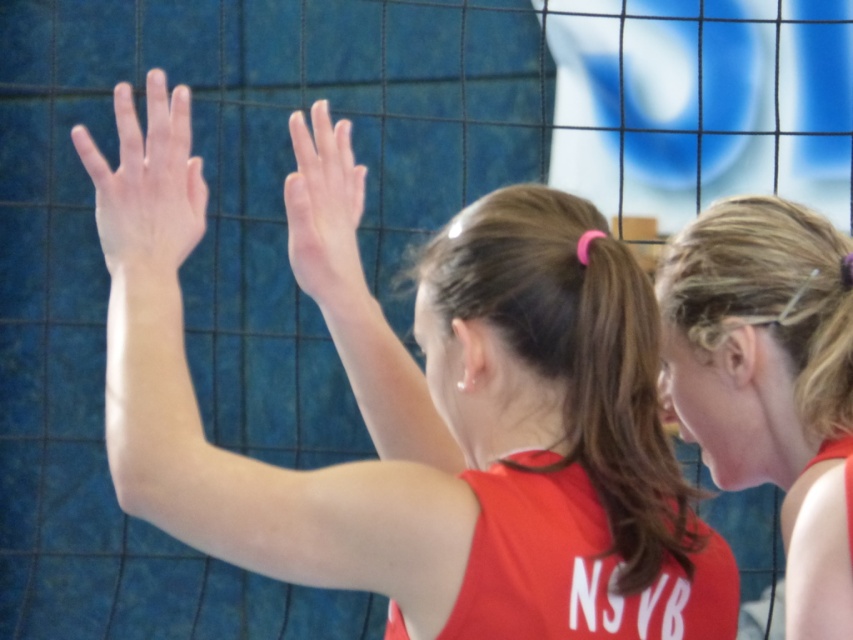
Question: Which object appears closest to the camera in this image?

Choices:
 (A) matte red tank top at upper right
 (B) matte red jersey at center
 (C) pale skin/hair at upper center
 (D) smooth skin hand at center

Answer: (B)

Question: Does matte red tank top at upper right come behind smooth skin hand at center?

Choices:
 (A) yes
 (B) no

Answer: (B)

Question: Among these points, which one is nearest to the camera?

Choices:
 (A) (787, 595)
 (B) (317, 196)

Answer: (A)

Question: In this image, where is matte red jersey at center located relative to pale skin/hair at upper center?

Choices:
 (A) left
 (B) right

Answer: (B)

Question: Which of these objects is positioned farthest from the pale skin/hair at upper center?

Choices:
 (A) matte red jersey at center
 (B) matte red tank top at upper right

Answer: (B)

Question: Does matte red tank top at upper right appear under pale skin/hair at upper center?

Choices:
 (A) yes
 (B) no

Answer: (A)